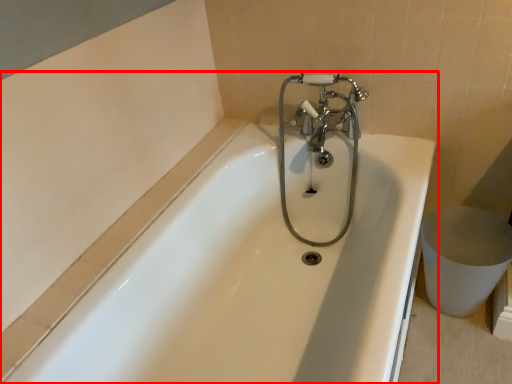
Question: Considering the relative positions of bathtub (annotated by the red box) and tap in the image provided, where is bathtub (annotated by the red box) located with respect to the staircase?

Choices:
 (A) right
 (B) left

Answer: (B)